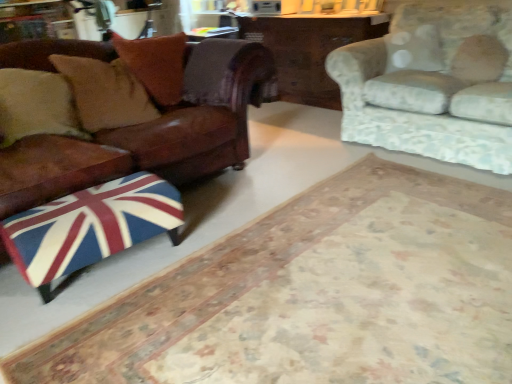
Question: Considering the relative positions of leather couch at left, the first studio couch when ordered from left to right, and floral fabric couch at upper right, which is counted as the 2th studio couch, starting from the left, in the image provided, is leather couch at left, the first studio couch when ordered from left to right, behind floral fabric couch at upper right, which is counted as the 2th studio couch, starting from the left,?

Choices:
 (A) no
 (B) yes

Answer: (A)

Question: From the image's perspective, is leather couch at left, the second studio couch positioned from the right, below floral fabric couch at upper right, which is counted as the 2th studio couch, starting from the left?

Choices:
 (A) no
 (B) yes

Answer: (B)

Question: Is leather couch at left, the first studio couch when ordered from left to right, positioned with its back to floral fabric couch at upper right, which is counted as the 2th studio couch, starting from the left?

Choices:
 (A) no
 (B) yes

Answer: (A)

Question: Is leather couch at left, the first studio couch when ordered from left to right, outside of floral fabric couch at upper right, the first studio couch when ordered from right to left?

Choices:
 (A) yes
 (B) no

Answer: (A)

Question: Is leather couch at left, the first studio couch when ordered from left to right, to the right of floral fabric couch at upper right, which is counted as the 2th studio couch, starting from the left, from the viewer's perspective?

Choices:
 (A) yes
 (B) no

Answer: (B)

Question: Is leather cushion at left, which appears as the third pillow when viewed from the right, spatially inside brown leather pillow at upper left, acting as the second pillow starting from the right, or outside of it?

Choices:
 (A) outside
 (B) inside

Answer: (A)

Question: Does point (73, 69) appear closer or farther from the camera than point (165, 72)?

Choices:
 (A) closer
 (B) farther

Answer: (A)

Question: Is leather cushion at left, which appears as the third pillow when viewed from the right, to the left or to the right of brown leather pillow at upper left, marked as the second pillow in a left-to-right arrangement, in the image?

Choices:
 (A) left
 (B) right

Answer: (A)

Question: From the image's perspective, is leather cushion at left, which appears as the third pillow when viewed from the right, above or below brown leather pillow at upper left, marked as the second pillow in a left-to-right arrangement?

Choices:
 (A) above
 (B) below

Answer: (B)

Question: Looking at their shapes, would you say union jack fabric ottoman at lower left is wider or thinner than fluffy white pillow at upper right, which is the 3th pillow in left-to-right order?

Choices:
 (A) thin
 (B) wide

Answer: (B)

Question: Looking at the image, does union jack fabric ottoman at lower left seem bigger or smaller compared to fluffy white pillow at upper right, which is the 3th pillow in left-to-right order?

Choices:
 (A) small
 (B) big

Answer: (B)

Question: Is point (359, 203) positioned closer to the camera than point (481, 39)?

Choices:
 (A) closer
 (B) farther

Answer: (A)

Question: In the image, is union jack fabric ottoman at lower left positioned in front of or behind fluffy white pillow at upper right, the 1th pillow when ordered from right to left?

Choices:
 (A) behind
 (B) front

Answer: (B)

Question: Looking at the image, does union jack fabric ottoman at lower left seem bigger or smaller compared to fluffy white pillow at upper right, the 1th pillow when ordered from right to left?

Choices:
 (A) big
 (B) small

Answer: (A)

Question: Considering the positions of union jack fabric ottoman at lower left and fluffy white pillow at upper right, which is the 3th pillow in left-to-right order, in the image, is union jack fabric ottoman at lower left wider or thinner than fluffy white pillow at upper right, which is the 3th pillow in left-to-right order,?

Choices:
 (A) thin
 (B) wide

Answer: (B)